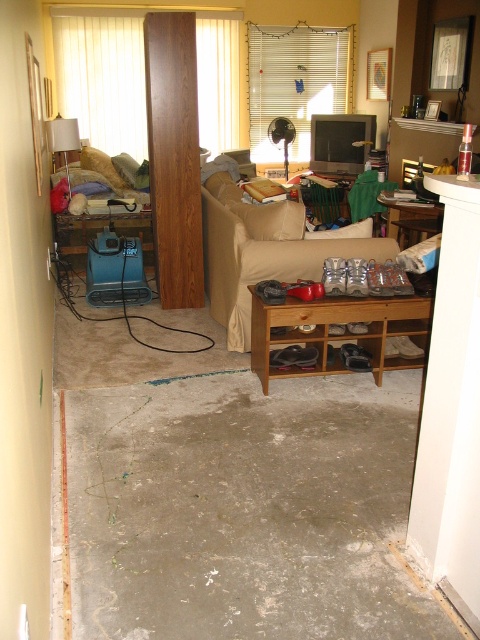
Question: Estimate the real-world distances between objects in this image. Which object is closer to the matte white lampshade at upper left?

Choices:
 (A) beige fabric couch at center
 (B) wooden shoe rack at center

Answer: (A)

Question: Which of the following is the closest to the observer?

Choices:
 (A) wooden pillar at center
 (B) beige fabric couch at center
 (C) gray concrete floor at lower center

Answer: (C)

Question: Is gray concrete floor at lower center smaller than wooden shoe rack at center?

Choices:
 (A) no
 (B) yes

Answer: (A)

Question: Is gray concrete floor at lower center wider than wooden pillar at center?

Choices:
 (A) no
 (B) yes

Answer: (B)

Question: Is gray concrete floor at lower center above wooden pillar at center?

Choices:
 (A) no
 (B) yes

Answer: (A)

Question: Which point is closer to the camera taking this photo?

Choices:
 (A) (48, 128)
 (B) (228, 460)
 (C) (303, 228)
 (D) (170, 81)

Answer: (B)